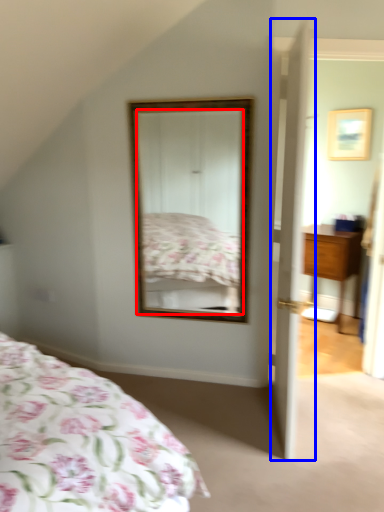
Question: Among these objects, which one is farthest to the camera, mirror (highlighted by a red box) or door (highlighted by a blue box)?

Choices:
 (A) mirror
 (B) door

Answer: (A)